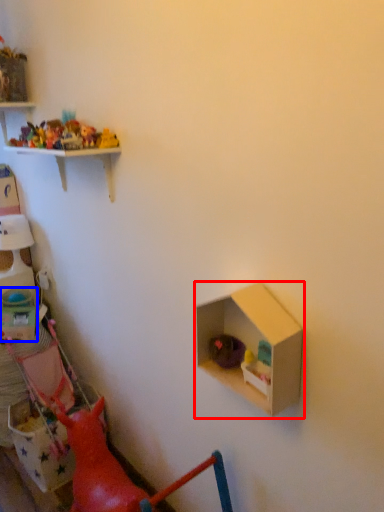
Question: Which object is further to the camera taking this photo, shelf (highlighted by a red box) or box (highlighted by a blue box)?

Choices:
 (A) shelf
 (B) box

Answer: (B)